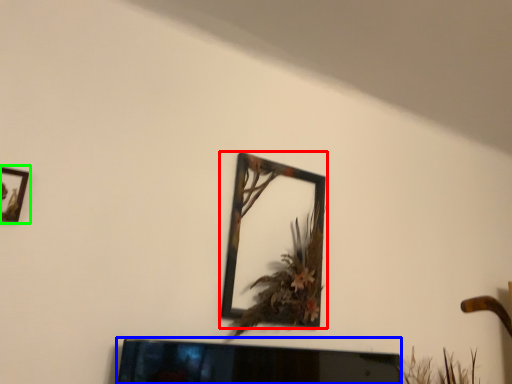
Question: Which object is positioned closest to picture frame (highlighted by a red box)? Select from television (highlighted by a blue box) and picture frame (highlighted by a green box).

Choices:
 (A) television
 (B) picture frame

Answer: (A)